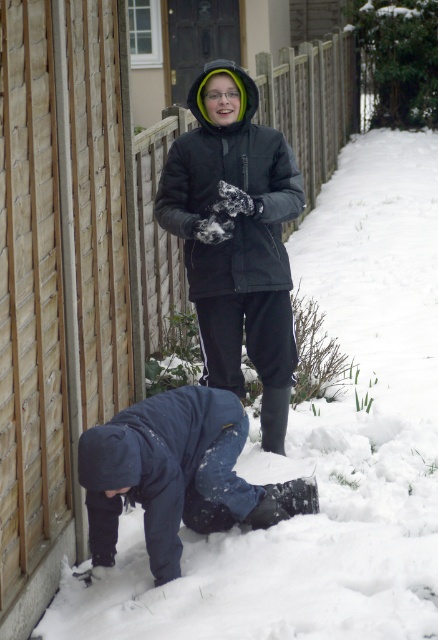
Question: Can you confirm if matte black jacket at center is positioned to the right of dark blue fabric at lower center?

Choices:
 (A) no
 (B) yes

Answer: (B)

Question: Which point appears closest to the camera in this image?

Choices:
 (A) (190, 225)
 (B) (191, 400)

Answer: (B)

Question: Does matte black jacket at center have a larger size compared to dark blue fabric at lower center?

Choices:
 (A) no
 (B) yes

Answer: (B)

Question: Which point appears farthest from the camera in this image?

Choices:
 (A) (232, 424)
 (B) (275, 307)

Answer: (B)

Question: Is matte black jacket at center to the right of dark blue fabric at lower center from the viewer's perspective?

Choices:
 (A) yes
 (B) no

Answer: (A)

Question: Among these objects, which one is farthest from the camera?

Choices:
 (A) dark blue fabric at lower center
 (B) matte black jacket at center

Answer: (B)